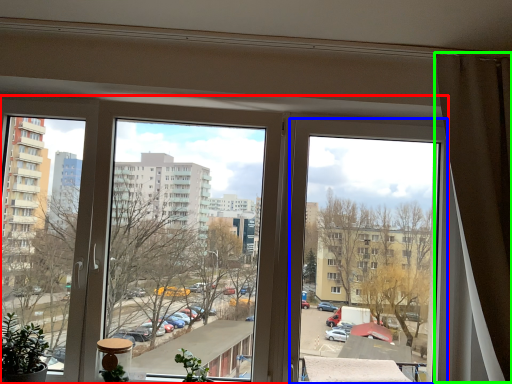
Question: Considering the real-world distances, which object is farthest from window (highlighted by a red box)? window (highlighted by a blue box) or curtain (highlighted by a green box)?

Choices:
 (A) window
 (B) curtain

Answer: (B)